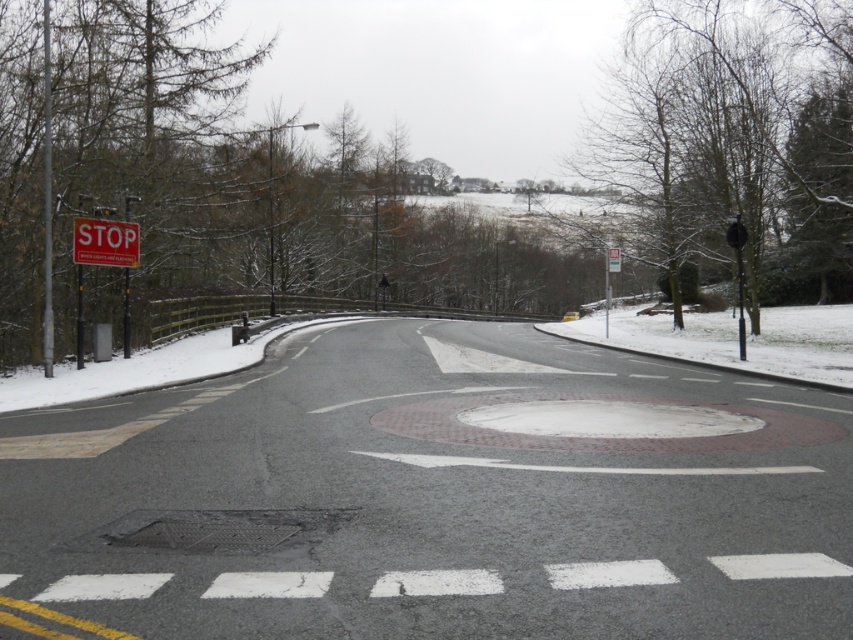
Can you confirm if red plastic stop sign at upper left is positioned to the left of metallic rectangular sign at upper center?

Indeed, red plastic stop sign at upper left is positioned on the left side of metallic rectangular sign at upper center.

Is red plastic stop sign at upper left smaller than metallic rectangular sign at upper center?

Yes, red plastic stop sign at upper left is smaller than metallic rectangular sign at upper center.

What are the coordinates of `red plastic stop sign at upper left` in the screenshot? It's located at (105, 243).

Find the location of a particular element. This screenshot has height=640, width=853. red plastic stop sign at upper left is located at coordinates (105, 243).